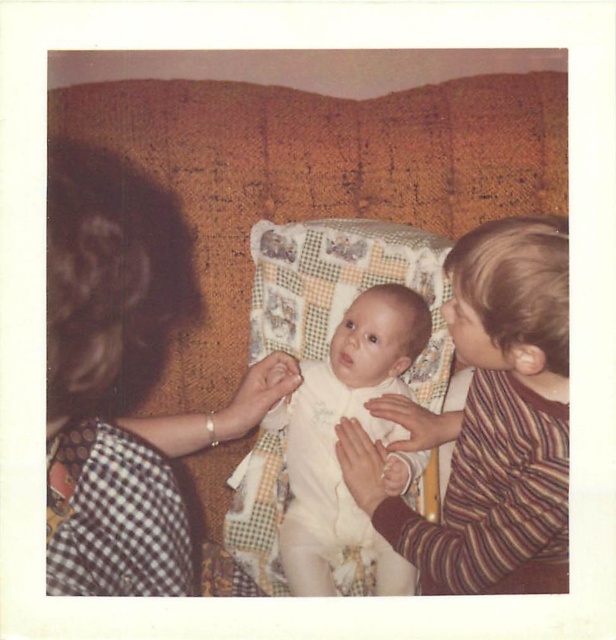
Who is more distant from viewer, (89,561) or (389,429)?

Positioned behind is point (389,429).

Can you confirm if black dotted dress at left is positioned to the left of white smooth onesie at center?

Yes, black dotted dress at left is to the left of white smooth onesie at center.

Describe the element at coordinates (123, 385) in the screenshot. This screenshot has height=640, width=616. I see `black dotted dress at left` at that location.

The image size is (616, 640). Find the location of `black dotted dress at left`. black dotted dress at left is located at coordinates (123, 385).